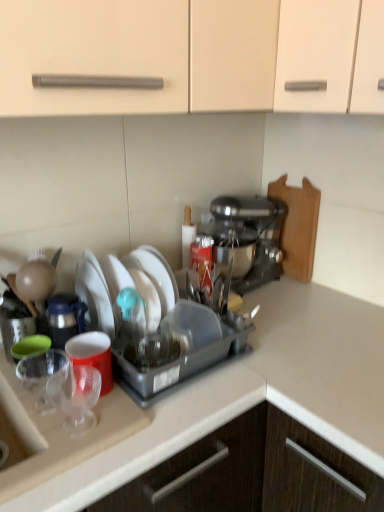
This screenshot has width=384, height=512. I want to click on free space in front of transparent plastic cup at lower left, the 1th tableware from the bottom, so click(53, 456).